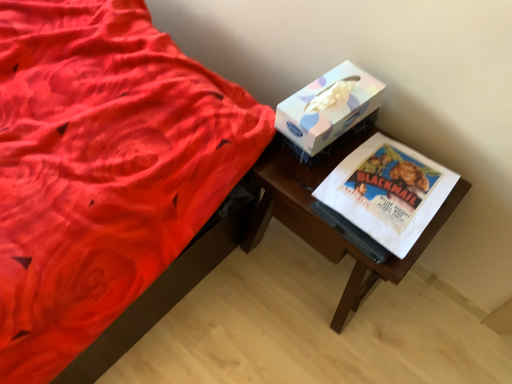
Locate an element on the screen. This screenshot has width=512, height=384. vacant space underneath wooden table at right (from a real-world perspective) is located at coordinates (307, 271).